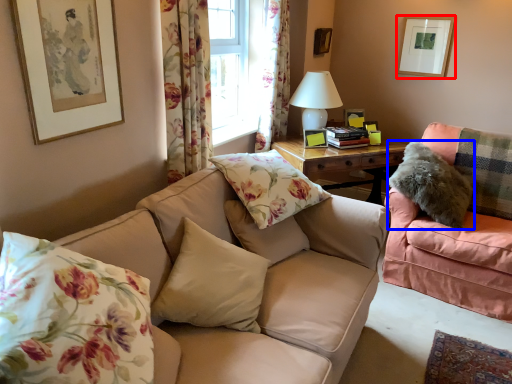
Question: Which point is further to the camera, picture frame (highlighted by a red box) or pillow (highlighted by a blue box)?

Choices:
 (A) picture frame
 (B) pillow

Answer: (A)